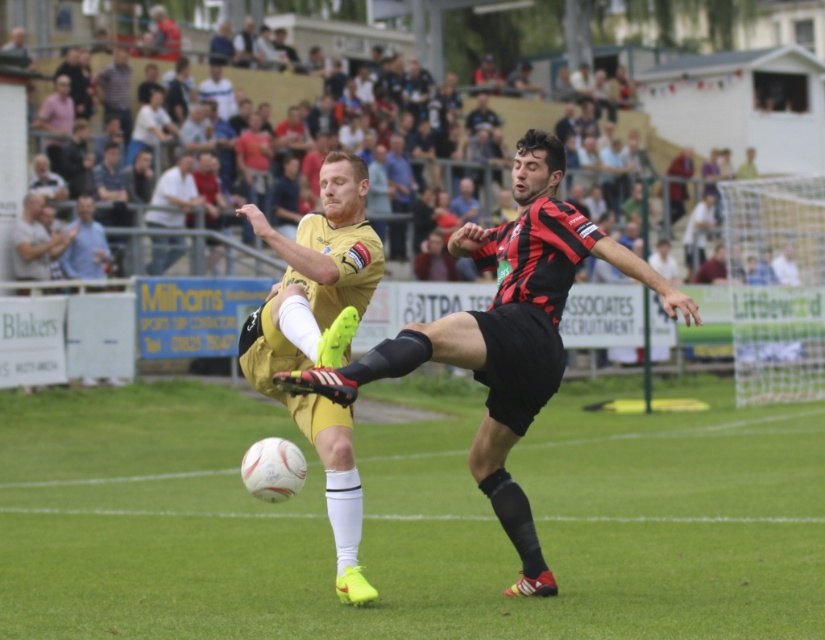
You are a soccer coach analyzing the play. You notice two key players in the image. The first is the matte gold jersey at center, and the second is the light beige shirt at upper center. Based on their positions, which player is positioned to the right side of the other?

The matte gold jersey at center is to the right of the light beige shirt at upper center, so the matte gold jersey at center is positioned to the right side of the light beige shirt at upper center.

You are a soccer coach observing the game from the sidelines. You notice a point on the field at coordinates (663, 294) where you want to place a cone. If the distance from this point to the sideline is 31.41 feet, is this point within the field boundaries?

The point at (663, 294) is 31.41 feet away from the sideline. Since soccer fields typically have sidelines that mark the boundaries, if the distance from the point to the sideline is 31.41 feet, the point is likely within the field boundaries as it is not touching or crossing the sideline.

You are a referee observing the soccer match. You notice two players, the matte gold jersey at center and the yellow matte jersey at center, competing for the ball. Which player is shorter in height?

The matte gold jersey at center has a lesser height compared to the yellow matte jersey at center, so the player wearing the matte gold jersey at center is shorter.